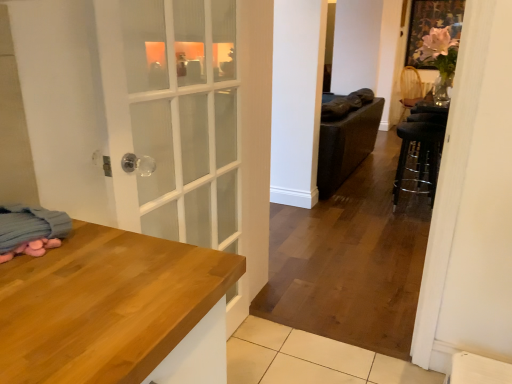
In order to face black metal bar stool at right, should I rotate leftwards or rightwards?

You should look right and rotate roughly 20.167 degrees.

Image resolution: width=512 pixels, height=384 pixels. What do you see at coordinates (31, 230) in the screenshot? I see `blue soft blanket at lower left` at bounding box center [31, 230].

I want to click on black metal bar stool at right, so click(419, 153).

From a real-world perspective, is woven wicker chair at upper right over black metal bar stool at right?

Yes, from a real-world perspective, woven wicker chair at upper right is over black metal bar stool at right

Image resolution: width=512 pixels, height=384 pixels. Find the location of `armchair above the black metal bar stool at right (from a real-world perspective)`. armchair above the black metal bar stool at right (from a real-world perspective) is located at coordinates (410, 89).

Based on the photo, how many degrees apart are the facing directions of woven wicker chair at upper right and black metal bar stool at right?

There is a 53.3-degree angle between the facing directions of woven wicker chair at upper right and black metal bar stool at right.

From the image's perspective, would you say blue soft blanket at lower left is shown under black metal bar stool at right?

Indeed, from the image's perspective, blue soft blanket at lower left is shown beneath black metal bar stool at right.

Is blue soft blanket at lower left bigger than black metal bar stool at right?

Actually, blue soft blanket at lower left might be smaller than black metal bar stool at right.

From a real-world perspective, is blue soft blanket at lower left positioned over black metal bar stool at right based on gravity?

Correct, in the physical world, blue soft blanket at lower left is higher than black metal bar stool at right.

Does blue soft blanket at lower left turn towards black metal bar stool at right?

No, blue soft blanket at lower left does not turn towards black metal bar stool at right.

Could you tell me if black metal bar stool at right is turned towards woven wicker chair at upper right?

No, black metal bar stool at right is not oriented towards woven wicker chair at upper right.

Is black metal bar stool at right wider than woven wicker chair at upper right?

In fact, black metal bar stool at right might be narrower than woven wicker chair at upper right.

Considering the positions of objects black metal bar stool at right and woven wicker chair at upper right in the image provided, who is behind, black metal bar stool at right or woven wicker chair at upper right?

woven wicker chair at upper right is further away from the camera.

Which is closer, (416, 133) or (415, 68)?

Point (416, 133).

In terms of width, does black metal bar stool at right look wider or thinner when compared to blue soft blanket at lower left?

In the image, black metal bar stool at right appears to be wider than blue soft blanket at lower left.

Can you tell me how much black metal bar stool at right and blue soft blanket at lower left differ in facing direction?

The facing directions of black metal bar stool at right and blue soft blanket at lower left are 6.72 degrees apart.

Looking at this image, from a real-world perspective, is black metal bar stool at right located higher than blue soft blanket at lower left?

No.

Is black metal bar stool at right in front of or behind blue soft blanket at lower left in the image?

black metal bar stool at right is behind blue soft blanket at lower left.

Can you confirm if woven wicker chair at upper right is taller than blue soft blanket at lower left?

Yes.

How different are the orientations of woven wicker chair at upper right and blue soft blanket at lower left in degrees?

46.6 degrees separate the facing orientations of woven wicker chair at upper right and blue soft blanket at lower left.

Does woven wicker chair at upper right have a larger size compared to blue soft blanket at lower left?

Yes.

Between woven wicker chair at upper right and blue soft blanket at lower left, which one is positioned behind?

woven wicker chair at upper right is behind.

From a real-world perspective, which is physically below, blue soft blanket at lower left or woven wicker chair at upper right?

woven wicker chair at upper right is physically lower.

Which is more to the right, blue soft blanket at lower left or woven wicker chair at upper right?

Positioned to the right is woven wicker chair at upper right.

Considering the sizes of blue soft blanket at lower left and woven wicker chair at upper right in the image, is blue soft blanket at lower left wider or thinner than woven wicker chair at upper right?

blue soft blanket at lower left is thinner than woven wicker chair at upper right.

The image size is (512, 384). Identify the location of armchair that is above the black metal bar stool at right (from a real-world perspective). (410, 89).

The height and width of the screenshot is (384, 512). Find the location of `bar stool behind the blue soft blanket at lower left`. bar stool behind the blue soft blanket at lower left is located at coordinates (419, 153).

When comparing their distances from blue soft blanket at lower left, does black metal bar stool at right or woven wicker chair at upper right seem closer?

The object closer to blue soft blanket at lower left is black metal bar stool at right.

Estimate the real-world distances between objects in this image. Which object is further from woven wicker chair at upper right, blue soft blanket at lower left or black metal bar stool at right?

blue soft blanket at lower left lies further to woven wicker chair at upper right than the other object.

From the image, which object appears to be farther from black metal bar stool at right, woven wicker chair at upper right or blue soft blanket at lower left?

Based on the image, blue soft blanket at lower left appears to be further to black metal bar stool at right.

When comparing their distances from woven wicker chair at upper right, does black metal bar stool at right or blue soft blanket at lower left seem closer?

black metal bar stool at right.

When comparing their distances from black metal bar stool at right, does blue soft blanket at lower left or woven wicker chair at upper right seem further?

Based on the image, blue soft blanket at lower left appears to be further to black metal bar stool at right.

Considering their positions, is woven wicker chair at upper right positioned further to blue soft blanket at lower left than black metal bar stool at right?

The object further to blue soft blanket at lower left is woven wicker chair at upper right.

Image resolution: width=512 pixels, height=384 pixels. In order to click on bar stool between blue soft blanket at lower left and woven wicker chair at upper right along the z-axis in this screenshot , I will do `click(419, 153)`.